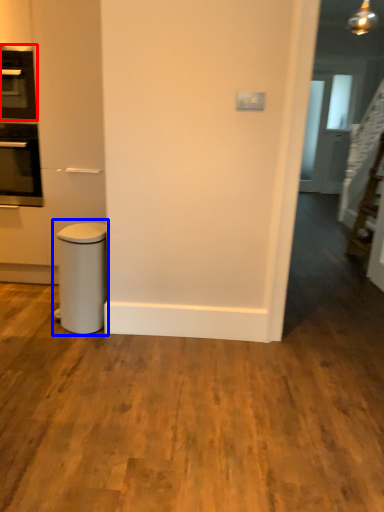
Question: Which point is further to the camera, home appliance (highlighted by a red box) or waste container (highlighted by a blue box)?

Choices:
 (A) home appliance
 (B) waste container

Answer: (A)